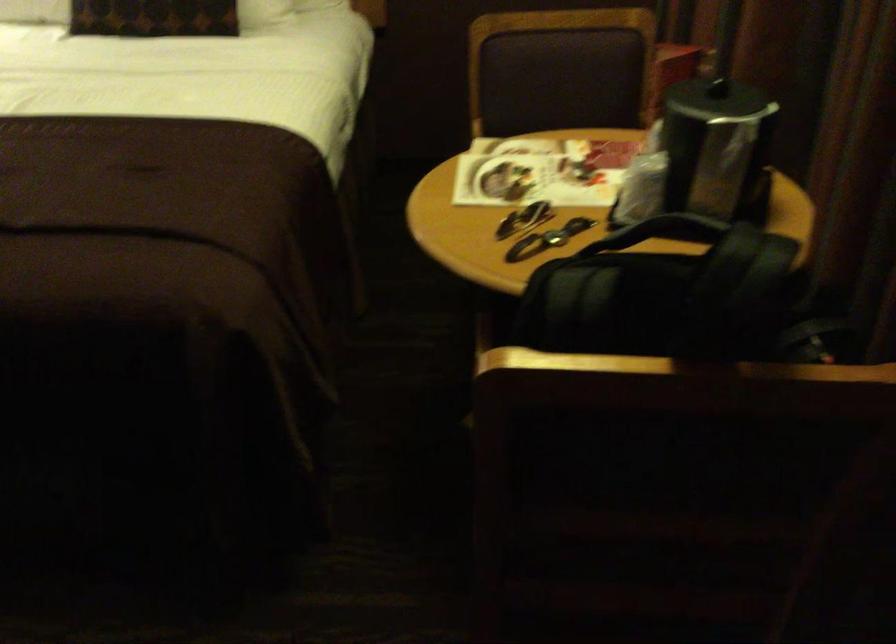
This screenshot has height=644, width=896. In order to click on backpack handle in this screenshot , I will do pos(670,229).